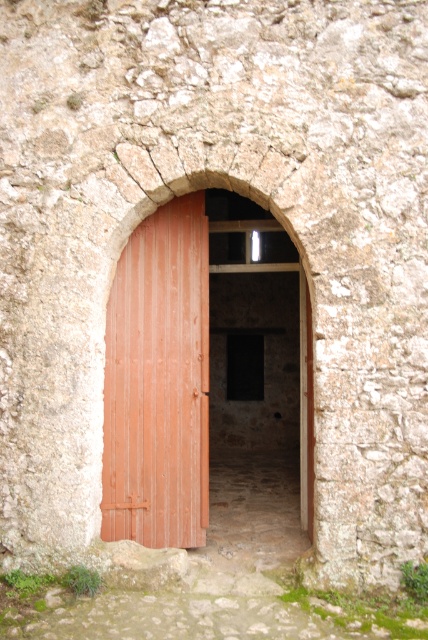
Question: Which point is closer to the camera?

Choices:
 (A) wooden door at center
 (B) brown wooden door at center

Answer: (B)

Question: Is wooden door at center behind brown wooden door at center?

Choices:
 (A) yes
 (B) no

Answer: (A)

Question: Where is wooden door at center located in relation to brown wooden door at center in the image?

Choices:
 (A) left
 (B) right

Answer: (B)

Question: Is wooden door at center wider than brown wooden door at center?

Choices:
 (A) no
 (B) yes

Answer: (A)

Question: Which point appears closest to the camera in this image?

Choices:
 (A) click(190, 221)
 (B) click(199, 312)

Answer: (B)